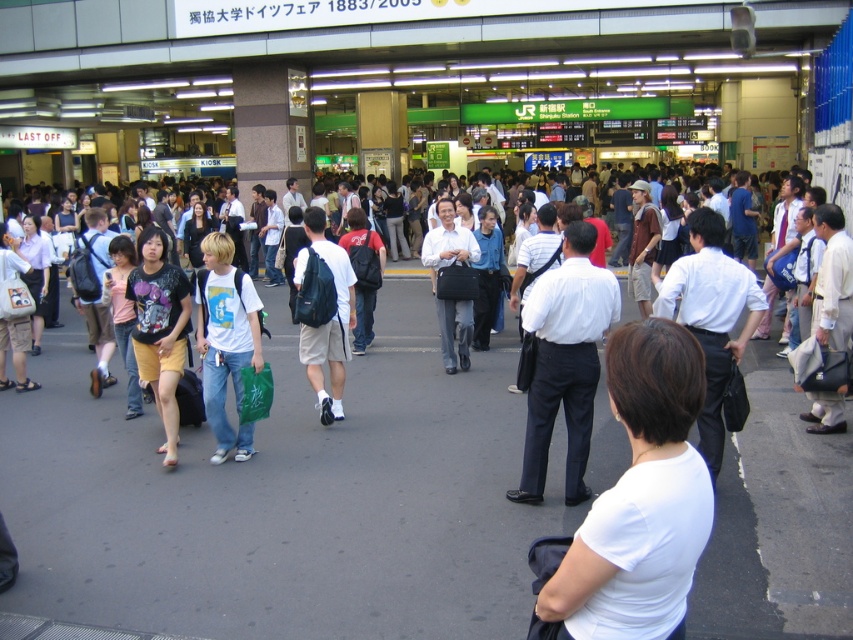
Between white matte shirt at center and white matte t-shirt at center, which one is positioned lower?

white matte shirt at center is lower down.

Consider the image. Is white matte shirt at center further to camera compared to white matte t-shirt at center?

No, it is in front of white matte t-shirt at center.

Who is more forward, [583,596] or [213,292]?

Point [583,596] is more forward.

You are a GUI agent. You are given a task and a screenshot of the screen. Output one action in this format:
    pyautogui.click(x=<x>, y=<y>)
    Task: Click on the white matte shirt at center
    The height and width of the screenshot is (640, 853).
    Given the screenshot: What is the action you would take?
    pyautogui.click(x=640, y=499)

I want to click on white smooth shirt at center, so click(x=566, y=362).

Which is above, white smooth shirt at center or white matte t-shirt at center?

white matte t-shirt at center

At what (x,y) coordinates should I click in order to perform the action: click on white smooth shirt at center. Please return your answer as a coordinate pair (x, y). Looking at the image, I should click on (566, 362).

You are a GUI agent. You are given a task and a screenshot of the screen. Output one action in this format:
    pyautogui.click(x=<x>, y=<y>)
    Task: Click on the white smooth shirt at center
    
    Given the screenshot: What is the action you would take?
    pyautogui.click(x=566, y=362)

Is matte black t-shirt at center closer to the viewer compared to matte black backpack at center?

Yes, matte black t-shirt at center is in front of matte black backpack at center.

From the picture: Does matte black t-shirt at center have a larger size compared to matte black backpack at center?

Actually, matte black t-shirt at center might be smaller than matte black backpack at center.

What do you see at coordinates (160, 330) in the screenshot? The height and width of the screenshot is (640, 853). I see `matte black t-shirt at center` at bounding box center [160, 330].

Image resolution: width=853 pixels, height=640 pixels. I want to click on matte black t-shirt at center, so click(160, 330).